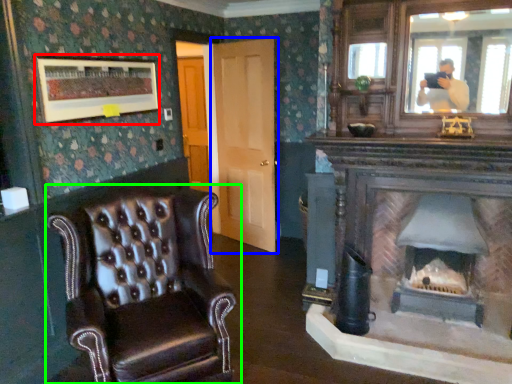
Question: Which object is the farthest from picture frame (highlighted by a red box)? Choose among these: door (highlighted by a blue box) or chair (highlighted by a green box).

Choices:
 (A) door
 (B) chair

Answer: (A)